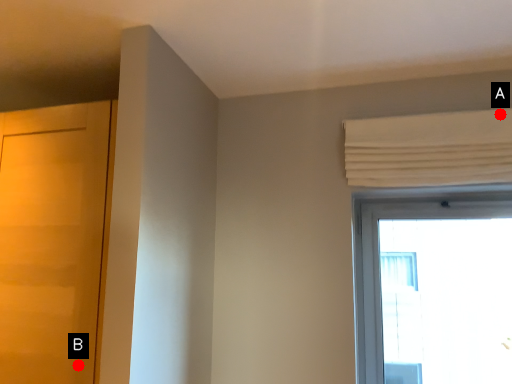
Question: Two points are circled on the image, labeled by A and B beside each circle. Which point is further to the camera?

Choices:
 (A) A is further
 (B) B is further

Answer: (A)